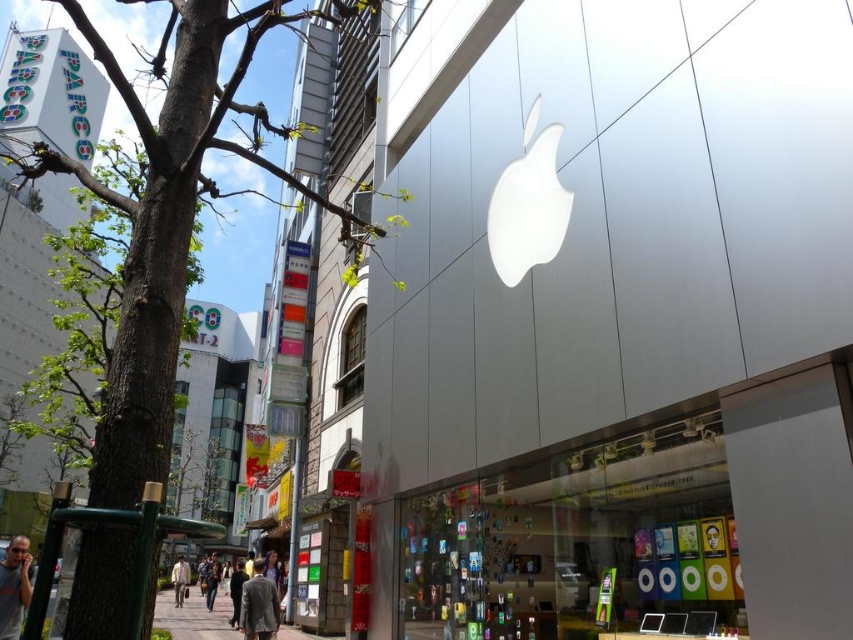
Does sleek silver store at center have a lesser height compared to black fabric pants at lower center?

Yes, sleek silver store at center is shorter than black fabric pants at lower center.

Can you confirm if sleek silver store at center is positioned to the right of black fabric pants at lower center?

Indeed, sleek silver store at center is positioned on the right side of black fabric pants at lower center.

Does point (793, 566) come in front of point (231, 618)?

Yes, point (793, 566) is in front of point (231, 618).

This screenshot has height=640, width=853. I want to click on sleek silver store at center, so click(x=619, y=332).

Is sleek silver store at center to the left of brown leather jacket at lower center from the viewer's perspective?

Incorrect, sleek silver store at center is not on the left side of brown leather jacket at lower center.

Does sleek silver store at center appear on the right side of brown leather jacket at lower center?

Yes, sleek silver store at center is to the right of brown leather jacket at lower center.

Is point (770, 291) more distant than point (213, 570)?

No.

You are a GUI agent. You are given a task and a screenshot of the screen. Output one action in this format:
    pyautogui.click(x=<x>, y=<y>)
    Task: Click on the sleek silver store at center
    The height and width of the screenshot is (640, 853).
    Given the screenshot: What is the action you would take?
    pyautogui.click(x=619, y=332)

Is point (247, 582) positioned in front of point (234, 620)?

Yes, point (247, 582) is in front of point (234, 620).

Which of these two, gray wool coat at lower center or black fabric pants at lower center, stands taller?

With more height is black fabric pants at lower center.

Is point (260, 636) positioned behind point (235, 605)?

No, (260, 636) is in front of (235, 605).

Image resolution: width=853 pixels, height=640 pixels. Identify the location of gray wool coat at lower center. (258, 604).